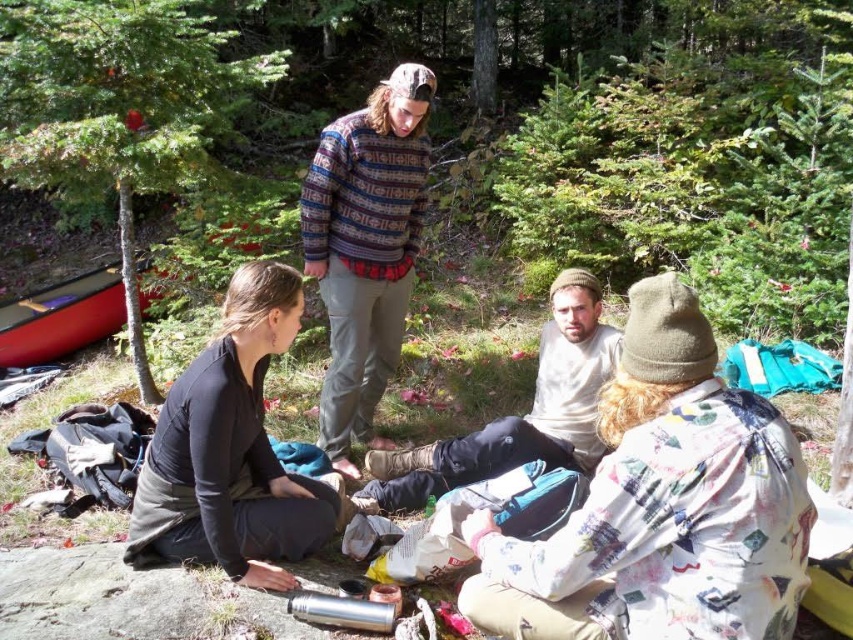
You are planning to take a photo of the fluffy beige hat at center while standing at the point labeled point (660, 506). Will you be able to see the hat clearly in your photo?

Yes, because the point (660, 506) corresponds to the fluffy beige hat at center, so you are standing exactly where the hat is located. Therefore, you can see it clearly.

You are navigating through the forest and want to reach the point at coordinates point (465, 596). There is an obstacle at point (509, 442). Will you need to go around the obstacle to reach your destination?

Point (465, 596) is in front of point (509, 442), so you do not need to go around the obstacle to reach your destination.

You are a photographer standing at the camera position. You want to take a photo of the black matte shirt at lower left. Can you focus on it clearly without moving your camera?

The black matte shirt at lower left is 2.40 meters away from the camera, so yes, you can focus on it clearly without moving your camera as this distance is within typical focusing range for most cameras.